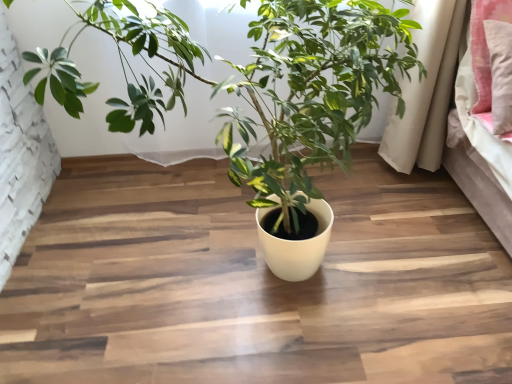
Question: From the image's perspective, is pink fabric pillow at upper right positioned above or below yellow matte pot at center?

Choices:
 (A) below
 (B) above

Answer: (B)

Question: Is point (485, 110) positioned closer to the camera than point (77, 89)?

Choices:
 (A) farther
 (B) closer

Answer: (A)

Question: Considering the positions of pink fabric pillow at upper right and yellow matte pot at center in the image, is pink fabric pillow at upper right taller or shorter than yellow matte pot at center?

Choices:
 (A) short
 (B) tall

Answer: (A)

Question: Is yellow matte pot at center to the left or to the right of pink fabric pillow at upper right in the image?

Choices:
 (A) left
 (B) right

Answer: (A)

Question: Is yellow matte pot at center inside the boundaries of pink fabric pillow at upper right, or outside?

Choices:
 (A) outside
 (B) inside

Answer: (A)

Question: In terms of size, does yellow matte pot at center appear bigger or smaller than pink fabric pillow at upper right?

Choices:
 (A) small
 (B) big

Answer: (B)

Question: From the image's perspective, relative to pink fabric pillow at upper right, is yellow matte pot at center above or below?

Choices:
 (A) above
 (B) below

Answer: (B)